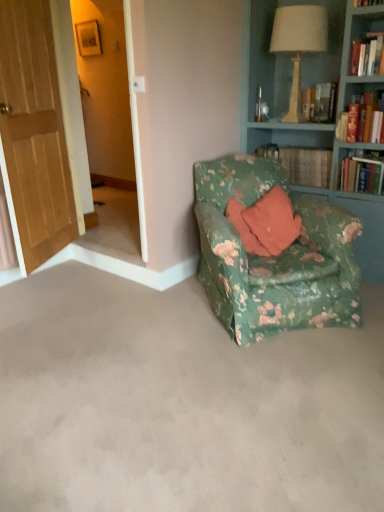
Measure the distance between point (383,348) and camera.

Point (383,348) and camera are 7.06 feet apart.

Describe the element at coordinates (301, 163) in the screenshot. I see `floral fabric cushion at center, placed as the 3th book when sorted from front to back` at that location.

What is the approximate width of floral fabric armchair at center?

floral fabric armchair at center is 1.01 meters wide.

In order to face wooden door at left, should I rotate leftwards or rightwards?

Turn left by 21.341 degrees to look at wooden door at left.

You are a GUI agent. You are given a task and a screenshot of the screen. Output one action in this format:
    pyautogui.click(x=<x>, y=<y>)
    Task: Click on the green floral fabric chair at lower right
    
    Given the screenshot: What is the action you would take?
    pyautogui.click(x=181, y=403)

Is wooden door at left facing away from floral fabric cushion at center, which is counted as the 1th book, starting from the back?

No, wooden door at left is not facing the opposite direction of floral fabric cushion at center, which is counted as the 1th book, starting from the back.

Which book is the 3rd one when counting from the back of the wooden door at left? Please provide its 2D coordinates.

[(301, 163)]

Does wooden door at left appear on the right side of floral fabric cushion at center, placed as the 3th book when sorted from front to back?

In fact, wooden door at left is to the left of floral fabric cushion at center, placed as the 3th book when sorted from front to back.

Is point (29, 109) in front of point (311, 163)?

Yes, it is.

Can green floral fabric chair at lower right be found inside hardcover book at upper right, the 2th book in the front-to-back sequence?

No.

Which is in front, point (368, 155) or point (213, 466)?

The point (213, 466) is in front.

From their relative heights in the image, would you say hardcover book at upper right, marked as the 2th book in a back-to-front arrangement, is taller or shorter than green floral fabric chair at lower right?

Clearly, hardcover book at upper right, marked as the 2th book in a back-to-front arrangement, is taller compared to green floral fabric chair at lower right.

From a real-world perspective, which object rests below the other?

green floral fabric chair at lower right is physically lower.

From the image's perspective, between green floral fabric chair at lower right and floral fabric cushion at center, which is counted as the 1th book, starting from the back, who is located below?

From the image's view, green floral fabric chair at lower right is below.

Can we say green floral fabric chair at lower right lies outside floral fabric cushion at center, which is counted as the 1th book, starting from the back?

Yes, green floral fabric chair at lower right is not within floral fabric cushion at center, which is counted as the 1th book, starting from the back.

Does green floral fabric chair at lower right lie in front of floral fabric cushion at center, which is counted as the 1th book, starting from the back?

That is True.

Considering the relative sizes of floral fabric armchair at center and green floral fabric chair at lower right in the image provided, is floral fabric armchair at center shorter than green floral fabric chair at lower right?

No, floral fabric armchair at center is not shorter than green floral fabric chair at lower right.

Considering the sizes of floral fabric armchair at center and green floral fabric chair at lower right in the image, is floral fabric armchair at center wider or thinner than green floral fabric chair at lower right?

In the image, floral fabric armchair at center appears to be more narrow than green floral fabric chair at lower right.

Is green floral fabric chair at lower right at the back of floral fabric armchair at center?

That's not correct — floral fabric armchair at center is not looking away from green floral fabric chair at lower right.

From the picture: Is there a large distance between green floral fabric chair at lower right and floral fabric armchair at center?

Actually, green floral fabric chair at lower right and floral fabric armchair at center are a little close together.

Considering the relative sizes of green floral fabric chair at lower right and floral fabric armchair at center in the image provided, is green floral fabric chair at lower right bigger than floral fabric armchair at center?

No.

Locate an element on the screen. Image resolution: width=384 pixels, height=512 pixels. chair behind the green floral fabric chair at lower right is located at coordinates (274, 256).

Is wooden screen door at left in contact with wooden door at left?

wooden screen door at left and wooden door at left are not in contact.

In the scene shown: How different are the orientations of wooden screen door at left and wooden door at left in degrees?

The facing directions of wooden screen door at left and wooden door at left are 118 degrees apart.

From the image's perspective, who appears lower, wooden screen door at left or wooden door at left?

wooden door at left appears lower in the image.

From a real-world perspective, relative to wooden door at left, is wooden screen door at left vertically above or below?

wooden screen door at left is above wooden door at left.

From the image's perspective, who appears lower, wooden screen door at left or floral fabric cushion at center, placed as the 3th book when sorted from front to back?

From the image's view, floral fabric cushion at center, placed as the 3th book when sorted from front to back, is below.

Is wooden screen door at left to the left of floral fabric cushion at center, which is counted as the 1th book, starting from the back, from the viewer's perspective?

Yes, wooden screen door at left is to the left of floral fabric cushion at center, which is counted as the 1th book, starting from the back.

Is point (132, 120) positioned behind point (296, 182)?

No, it is not.

Who is bigger, wooden screen door at left or floral fabric cushion at center, which is counted as the 1th book, starting from the back?

wooden screen door at left is bigger.

Locate an element on the screen. This screenshot has height=512, width=384. book that is the 3rd one when counting backward from the wooden door at left is located at coordinates (301, 163).

Where is `concrete that is in front of the hardcover book at upper right, the 2th book in the front-to-back sequence`? The height and width of the screenshot is (512, 384). concrete that is in front of the hardcover book at upper right, the 2th book in the front-to-back sequence is located at coordinates (181, 403).

Consider the image. When comparing their distances from wooden door at left, does hardcover book at upper right, the 2th book in the front-to-back sequence, or floral fabric cushion at center, which is counted as the 1th book, starting from the back, seem further?

hardcover book at upper right, the 2th book in the front-to-back sequence, is positioned further to the anchor wooden door at left.

Based on their spatial positions, is floral fabric cushion at center, which is counted as the 1th book, starting from the back, or hardcover book at upper right, arranged as the 3th book when viewed from the back, closer to green floral fabric chair at lower right?

The object closer to green floral fabric chair at lower right is floral fabric cushion at center, which is counted as the 1th book, starting from the back.

From the image, which object appears to be farther from green floral fabric chair at lower right, hardcover book at upper right, marked as the 2th book in a back-to-front arrangement, or floral fabric cushion at center, which is counted as the 1th book, starting from the back?

Based on the image, floral fabric cushion at center, which is counted as the 1th book, starting from the back, appears to be further to green floral fabric chair at lower right.

Based on the photo, which object lies further to the anchor point green floral fabric chair at lower right, wooden door at left or floral fabric armchair at center?

wooden door at left lies further to green floral fabric chair at lower right than the other object.

Which object lies further to the anchor point floral fabric cushion at center, placed as the 3th book when sorted from front to back, green floral fabric chair at lower right or wooden door at left?

wooden door at left.

Which object lies nearer to the anchor point wooden door at left, floral fabric cushion at center, placed as the 3th book when sorted from front to back, or hardcover book at upper right, the 2th book in the front-to-back sequence?

The object closer to wooden door at left is floral fabric cushion at center, placed as the 3th book when sorted from front to back.

From the image, which object appears to be farther from hardcover book at upper right, the 2th book in the front-to-back sequence, floral fabric armchair at center or floral fabric cushion at center, which is counted as the 1th book, starting from the back?

floral fabric armchair at center is positioned further to the anchor hardcover book at upper right, the 2th book in the front-to-back sequence.

Based on their spatial positions, is hardcover book at upper right, marked as the 2th book in a back-to-front arrangement, or matte beige lampshade at upper right closer to green floral fabric chair at lower right?

hardcover book at upper right, marked as the 2th book in a back-to-front arrangement.

Where is `chair between wooden door at left and matte beige lampshade at upper right`? chair between wooden door at left and matte beige lampshade at upper right is located at coordinates (274, 256).

Where is `lamp situated between wooden screen door at left and floral fabric cushion at center, which is counted as the 1th book, starting from the back, from left to right`? The image size is (384, 512). lamp situated between wooden screen door at left and floral fabric cushion at center, which is counted as the 1th book, starting from the back, from left to right is located at coordinates (298, 44).

Locate an element on the screen. The image size is (384, 512). concrete between wooden door at left and hardcover book at upper right, the 2th book in the front-to-back sequence, in the horizontal direction is located at coordinates (181, 403).

Where is `screen door positioned between green floral fabric chair at lower right and floral fabric cushion at center, which is counted as the 1th book, starting from the back, from near to far`? Image resolution: width=384 pixels, height=512 pixels. screen door positioned between green floral fabric chair at lower right and floral fabric cushion at center, which is counted as the 1th book, starting from the back, from near to far is located at coordinates (111, 100).